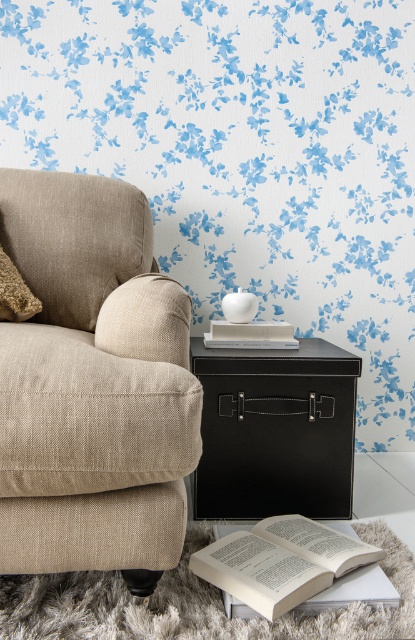
Question: Which is nearer to the black leather side table at center?

Choices:
 (A) white paper book at lower center
 (B) beige fabric couch at left

Answer: (A)

Question: Observing the image, what is the correct spatial positioning of beige fabric couch at left in reference to white paper book at lower center?

Choices:
 (A) left
 (B) right

Answer: (A)

Question: Is beige fabric couch at left below black leather side table at center?

Choices:
 (A) no
 (B) yes

Answer: (A)

Question: Is black leather side table at center below fuzzy beige pillow at left?

Choices:
 (A) no
 (B) yes

Answer: (B)

Question: Which point is closer to the camera?

Choices:
 (A) fuzzy beige pillow at left
 (B) black leather side table at center

Answer: (A)

Question: Which point is closer to the camera?

Choices:
 (A) black leather side table at center
 (B) fuzzy beige pillow at left
 (C) white paper book at lower center
 (D) beige fabric couch at left

Answer: (D)